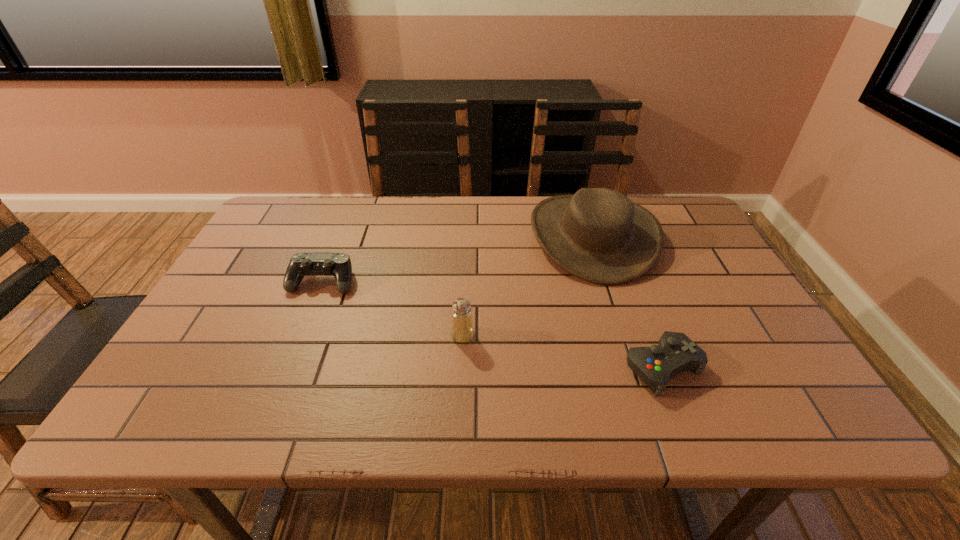
This screenshot has width=960, height=540. In order to click on vacant region at the far right corner of the desktop in this screenshot , I will do `click(667, 224)`.

Image resolution: width=960 pixels, height=540 pixels. What are the coordinates of `free spot at the near right corner of the desktop` in the screenshot? It's located at (811, 409).

Where is `vacant space that is in between the cowboy hat and the right control`? The image size is (960, 540). vacant space that is in between the cowboy hat and the right control is located at coordinates (628, 302).

Image resolution: width=960 pixels, height=540 pixels. In order to click on free space between the leftmost object and the third object from right to left in this screenshot , I will do `click(393, 308)`.

Where is `free spot between the leftmost object and the second object from left to right`? free spot between the leftmost object and the second object from left to right is located at coordinates (393, 308).

Find the location of a particular element. The image size is (960, 540). free space that is in between the tallest object and the left control is located at coordinates (458, 259).

This screenshot has height=540, width=960. I want to click on empty space that is in between the third shortest object and the leftmost object, so [393, 308].

Locate an element on the screen. The height and width of the screenshot is (540, 960). free space between the nearer control and the tallest object is located at coordinates (628, 302).

Locate an element on the screen. This screenshot has height=540, width=960. free space between the farther control and the tallest object is located at coordinates (458, 259).

Where is `vacant region between the cowboy hat and the left control`? vacant region between the cowboy hat and the left control is located at coordinates (458, 259).